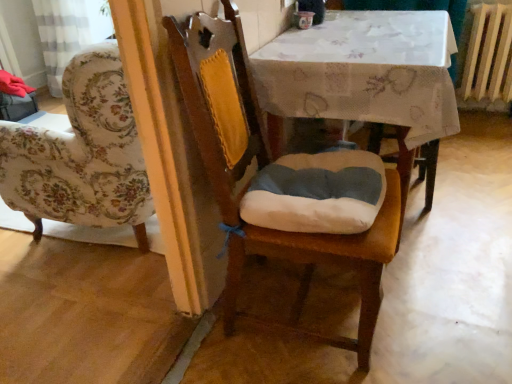
Image resolution: width=512 pixels, height=384 pixels. Identify the location of free spot to the right of white fabric table at center. (477, 179).